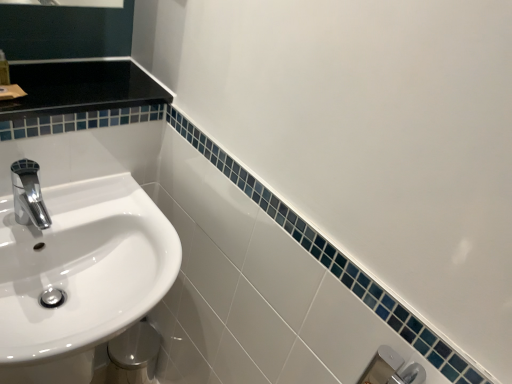
Question: Is white glossy sink at left bigger or smaller than chrome/metallic faucet at left?

Choices:
 (A) small
 (B) big

Answer: (B)

Question: Is white glossy sink at left spatially inside chrome/metallic faucet at left, or outside of it?

Choices:
 (A) inside
 (B) outside

Answer: (B)

Question: Considering the real-world distances, which object is closest to the translucent plastic soap dispenser at upper left?

Choices:
 (A) chrome/metallic faucet at left
 (B) white glossy sink at left

Answer: (A)

Question: Considering the real-world distances, which object is farthest from the white glossy sink at left?

Choices:
 (A) translucent plastic soap dispenser at upper left
 (B) chrome/metallic faucet at left

Answer: (A)